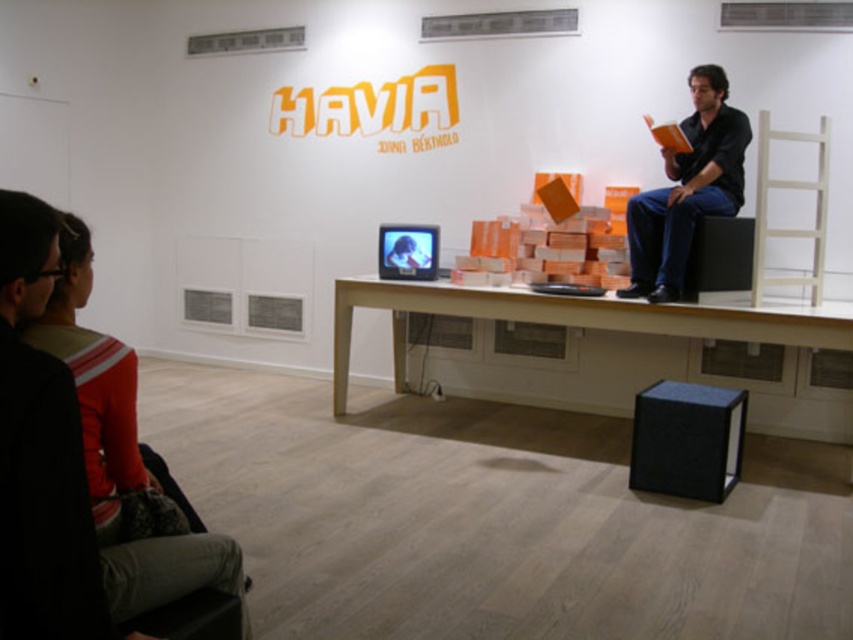
How distant is matte black shirt at upper right from black matte speaker at center?

They are 8.68 inches apart.

What are the coordinates of `matte black shirt at upper right` in the screenshot? It's located at (688, 189).

Is point (706, 109) closer to camera compared to point (689, 289)?

No.

Where is `matte black shirt at upper right`? matte black shirt at upper right is located at coordinates (688, 189).

Between orange sweater at upper left and matte black shirt at upper right, which one has less height?

orange sweater at upper left

Is point (76, 268) farther from camera compared to point (680, 125)?

No, (76, 268) is in front of (680, 125).

The width and height of the screenshot is (853, 640). What are the coordinates of `orange sweater at upper left` in the screenshot? It's located at (126, 456).

Is white wood table at center in front of black matte speaker at center?

Yes, white wood table at center is in front of black matte speaker at center.

Is white wood table at center smaller than black matte speaker at center?

Incorrect, white wood table at center is not smaller in size than black matte speaker at center.

Does point (796, 314) come farther from viewer compared to point (720, 220)?

No, it is in front of (720, 220).

This screenshot has height=640, width=853. I want to click on white wood table at center, so click(x=575, y=317).